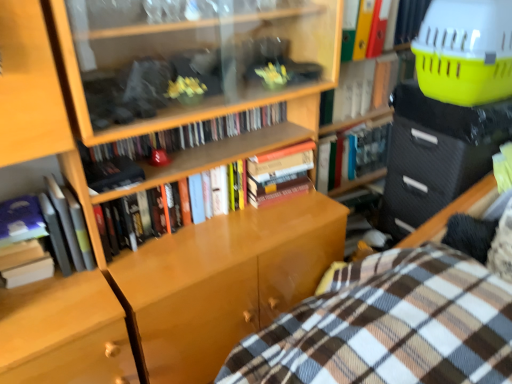
What is the approximate height of matte black bookshelf at upper center, positioned as the 5th book in right-to-left order?

The height of matte black bookshelf at upper center, positioned as the 5th book in right-to-left order, is 4.76 inches.

What do you see at coordinates (188, 134) in the screenshot?
I see `matte black bookshelf at upper center, positioned as the 5th book in right-to-left order` at bounding box center [188, 134].

From the picture: In order to face yellow plastic pet carrier at upper right, positioned as the 1th book in right-to-left order, should I rotate leftwards or rightwards?

It's best to rotate right around 20.207 degrees.

The image size is (512, 384). Describe the element at coordinates (437, 162) in the screenshot. I see `black textured drawer at right` at that location.

This screenshot has height=384, width=512. What do you see at coordinates (384, 72) in the screenshot?
I see `wooden bookshelf at center` at bounding box center [384, 72].

This screenshot has height=384, width=512. I want to click on matte black bookshelf at upper center, positioned as the 5th book in right-to-left order, so [x=188, y=134].

Would you consider hardcover book at center, positioned as the sixth book in left-to-right order, to be distant from hardcover book at center, which appears as the third book when viewed from the left?

hardcover book at center, positioned as the sixth book in left-to-right order, is near hardcover book at center, which appears as the third book when viewed from the left, not far away.

What's the angular difference between hardcover book at center, which is counted as the 3th book, starting from the right, and hardcover book at center, marked as the 6th book in a right-to-left arrangement,'s facing directions?

1.12 degrees separate the facing orientations of hardcover book at center, which is counted as the 3th book, starting from the right, and hardcover book at center, marked as the 6th book in a right-to-left arrangement.

From a real-world perspective, between hardcover book at center, positioned as the sixth book in left-to-right order, and hardcover book at center, which appears as the third book when viewed from the left, who is vertically higher?

hardcover book at center, which appears as the third book when viewed from the left, from a real-world perspective.

Is hardcover book at center, which is counted as the 3th book, starting from the right, aimed at hardcover book at center, marked as the 6th book in a right-to-left arrangement?

No, hardcover book at center, which is counted as the 3th book, starting from the right, is not aimed at hardcover book at center, marked as the 6th book in a right-to-left arrangement.

Are hardcover books at center, the fifth book positioned from the left, and plaid fabric bed at lower right far apart?

They are positioned close to each other.

What's the angular difference between hardcover books at center, the 4th book from the right, and plaid fabric bed at lower right's facing directions?

The angular difference between hardcover books at center, the 4th book from the right, and plaid fabric bed at lower right is 89.8 degrees.

From a real-world perspective, who is located higher, hardcover books at center, the 4th book from the right, or plaid fabric bed at lower right?

From a 3D spatial view, hardcover books at center, the 4th book from the right, is above.

Is yellow plastic pet carrier at upper right, acting as the eighth book starting from the left, positioned with its back to hardcover book at center, marked as the 6th book in a right-to-left arrangement?

No, yellow plastic pet carrier at upper right, acting as the eighth book starting from the left, is not facing the opposite direction of hardcover book at center, marked as the 6th book in a right-to-left arrangement.

From a real-world perspective, is yellow plastic pet carrier at upper right, positioned as the 1th book in right-to-left order, on hardcover book at center, marked as the 6th book in a right-to-left arrangement?

Yes, from a real-world perspective, yellow plastic pet carrier at upper right, positioned as the 1th book in right-to-left order, is on top of hardcover book at center, marked as the 6th book in a right-to-left arrangement.

Considering the sizes of yellow plastic pet carrier at upper right, acting as the eighth book starting from the left, and hardcover book at center, marked as the 6th book in a right-to-left arrangement, in the image, is yellow plastic pet carrier at upper right, acting as the eighth book starting from the left, bigger or smaller than hardcover book at center, marked as the 6th book in a right-to-left arrangement,?

In the image, yellow plastic pet carrier at upper right, acting as the eighth book starting from the left, appears to be larger than hardcover book at center, marked as the 6th book in a right-to-left arrangement.

This screenshot has width=512, height=384. What are the coordinates of `bookshelf below the yellow plastic pet carrier at upper right, positioned as the 1th book in right-to-left order (from the image's perspective)` in the screenshot? It's located at (384, 72).

In the scene shown: From a real-world perspective, is yellow plastic pet carrier at upper right, acting as the eighth book starting from the left, located beneath wooden bookshelf at center?

No, from a real-world perspective, yellow plastic pet carrier at upper right, acting as the eighth book starting from the left, is not beneath wooden bookshelf at center.

Looking at this image, from the image's perspective, does yellow plastic pet carrier at upper right, acting as the eighth book starting from the left, appear higher than wooden bookshelf at center?

Correct, yellow plastic pet carrier at upper right, acting as the eighth book starting from the left, appears higher than wooden bookshelf at center in the image.

Is yellow plastic pet carrier at upper right, positioned as the 1th book in right-to-left order, next to wooden bookshelf at center?

No, yellow plastic pet carrier at upper right, positioned as the 1th book in right-to-left order, is not beside wooden bookshelf at center.

Is hardcover book at center, which appears as the third book when viewed from the left, surrounding yellow plastic basket at upper right?

No.

Which of these two, hardcover book at center, marked as the 6th book in a right-to-left arrangement, or yellow plastic basket at upper right, stands taller?

Standing taller between the two is yellow plastic basket at upper right.

Are hardcover book at center, marked as the 6th book in a right-to-left arrangement, and yellow plastic basket at upper right beside each other?

No, hardcover book at center, marked as the 6th book in a right-to-left arrangement, is not in contact with yellow plastic basket at upper right.

Looking at this image, can you confirm if matte black bookshelf at upper center, placed as the fourth book when sorted from left to right, is wider than black textured drawer at right?

No.

Is matte black bookshelf at upper center, positioned as the 5th book in right-to-left order, surrounding black textured drawer at right?

No, black textured drawer at right is not inside matte black bookshelf at upper center, positioned as the 5th book in right-to-left order.

You are a GUI agent. You are given a task and a screenshot of the screen. Output one action in this format:
    pyautogui.click(x=<x>, y=<y>)
    Task: Click on the drawer that is on the right side of matte black bookshelf at upper center, positioned as the 5th book in right-to-left order
    The width and height of the screenshot is (512, 384).
    Given the screenshot: What is the action you would take?
    pyautogui.click(x=437, y=162)

Is yellow plastic pet carrier at upper right, positioned as the 1th book in right-to-left order, at the left side of hardcover book at center, which is counted as the 3th book, starting from the right?

No, yellow plastic pet carrier at upper right, positioned as the 1th book in right-to-left order, is not to the left of hardcover book at center, which is counted as the 3th book, starting from the right.

Can you confirm if yellow plastic pet carrier at upper right, acting as the eighth book starting from the left, is taller than hardcover book at center, which is counted as the 3th book, starting from the right?

Incorrect, the height of yellow plastic pet carrier at upper right, acting as the eighth book starting from the left, is not larger of that of hardcover book at center, which is counted as the 3th book, starting from the right.

From the picture: Is yellow plastic pet carrier at upper right, positioned as the 1th book in right-to-left order, oriented towards hardcover book at center, which is counted as the 3th book, starting from the right?

No, yellow plastic pet carrier at upper right, positioned as the 1th book in right-to-left order, does not turn towards hardcover book at center, which is counted as the 3th book, starting from the right.

How different are the orientations of yellow plastic pet carrier at upper right, acting as the eighth book starting from the left, and hardcover book at center, which is counted as the 3th book, starting from the right, in degrees?

They differ by 0.0056 degrees in their facing directions.

Which book is the 5th one when counting from the back of the hardcover book at center, marked as the 6th book in a right-to-left arrangement? Please provide its 2D coordinates.

[(354, 154)]

From the image's perspective, starting from the plaid fabric bed at lower right, which book is the 3rd one above? Please provide its 2D coordinates.

[(200, 164)]

Which object lies nearer to the anchor point hardcover book at left, acting as the first book starting from the left, black textured drawer at right or yellow plastic pet carrier at upper right, positioned as the 1th book in right-to-left order?

black textured drawer at right is closer to hardcover book at left, acting as the first book starting from the left.

Considering their positions, is hardcover book at center, positioned as the sixth book in left-to-right order, positioned further to plaid fabric bed at lower right than hardcover book at left, acting as the first book starting from the left?

The object further to plaid fabric bed at lower right is hardcover book at center, positioned as the sixth book in left-to-right order.

Looking at the image, which one is located closer to wooden bookshelf at center, hardcover books at center, the fifth book positioned from the left, or hardcover book at upper center, the seventh book in the left-to-right sequence?

hardcover book at upper center, the seventh book in the left-to-right sequence, is positioned closer to the anchor wooden bookshelf at center.

When comparing their distances from yellow plastic basket at upper right, does hardcover book at left, acting as the first book starting from the left, or hardcover book at center, marked as the 6th book in a right-to-left arrangement, seem closer?

The object closer to yellow plastic basket at upper right is hardcover book at center, marked as the 6th book in a right-to-left arrangement.

Estimate the real-world distances between objects in this image. Which object is further from matte black bookshelf at upper center, placed as the fourth book when sorted from left to right, yellow plastic pet carrier at upper right, positioned as the 1th book in right-to-left order, or wooden bookshelf at center?

Among the two, yellow plastic pet carrier at upper right, positioned as the 1th book in right-to-left order, is located further to matte black bookshelf at upper center, placed as the fourth book when sorted from left to right.

Based on their spatial positions, is hardcover book at center, positioned as the sixth book in left-to-right order, or plaid fabric bed at lower right further from hardcover books at center, the fifth book positioned from the left?

plaid fabric bed at lower right is positioned further to the anchor hardcover books at center, the fifth book positioned from the left.

Considering their positions, is yellow plastic basket at upper right positioned further to hardcover book at upper center, the seventh book in the left-to-right sequence, than hardcover book at left, which is the second book in left-to-right order?

hardcover book at left, which is the second book in left-to-right order, is further to hardcover book at upper center, the seventh book in the left-to-right sequence.

Considering their positions, is hardcover book at left, acting as the first book starting from the left, positioned further to hardcover book at upper center, positioned as the 2th book in right-to-left order, than black textured drawer at right?

hardcover book at left, acting as the first book starting from the left, is further to hardcover book at upper center, positioned as the 2th book in right-to-left order.

What are the coordinates of `bookshelf between hardcover book at left, the eighth book from the right, and hardcover book at upper center, the seventh book in the left-to-right sequence, from left to right` in the screenshot? It's located at (384, 72).

Image resolution: width=512 pixels, height=384 pixels. In order to click on basket between hardcover book at left, the eighth book from the right, and black textured drawer at right in this screenshot , I will do `click(465, 51)`.

Locate an element on the screen. This screenshot has height=384, width=512. bookshelf between hardcover book at center, which appears as the third book when viewed from the left, and hardcover book at center, positioned as the sixth book in left-to-right order, in the horizontal direction is located at coordinates (384, 72).

Locate an element on the screen. bookshelf between hardcover book at upper center, positioned as the 2th book in right-to-left order, and hardcover book at center, which is counted as the 3th book, starting from the right, in the up-down direction is located at coordinates (384, 72).